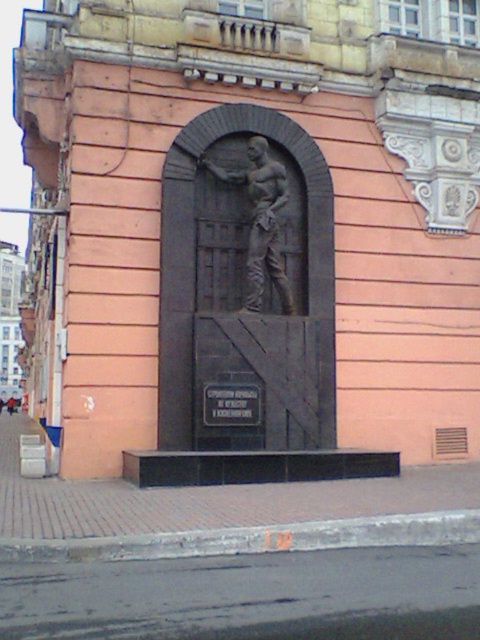
Question: Which of these objects is positioned closest to the black metal plaque at center?

Choices:
 (A) gray stone statue at center
 (B) black stone relief at center

Answer: (B)

Question: Based on their relative distances, which object is nearer to the black metal plaque at center?

Choices:
 (A) black stone relief at center
 (B) gray stone statue at center

Answer: (A)

Question: Is gray stone statue at center positioned before black metal plaque at center?

Choices:
 (A) yes
 (B) no

Answer: (B)

Question: Can you confirm if black stone relief at center is bigger than black metal plaque at center?

Choices:
 (A) no
 (B) yes

Answer: (B)

Question: Which object is closer to the camera taking this photo?

Choices:
 (A) gray stone statue at center
 (B) black metal plaque at center
 (C) black stone relief at center

Answer: (C)

Question: Is black stone relief at center wider than black metal plaque at center?

Choices:
 (A) yes
 (B) no

Answer: (A)